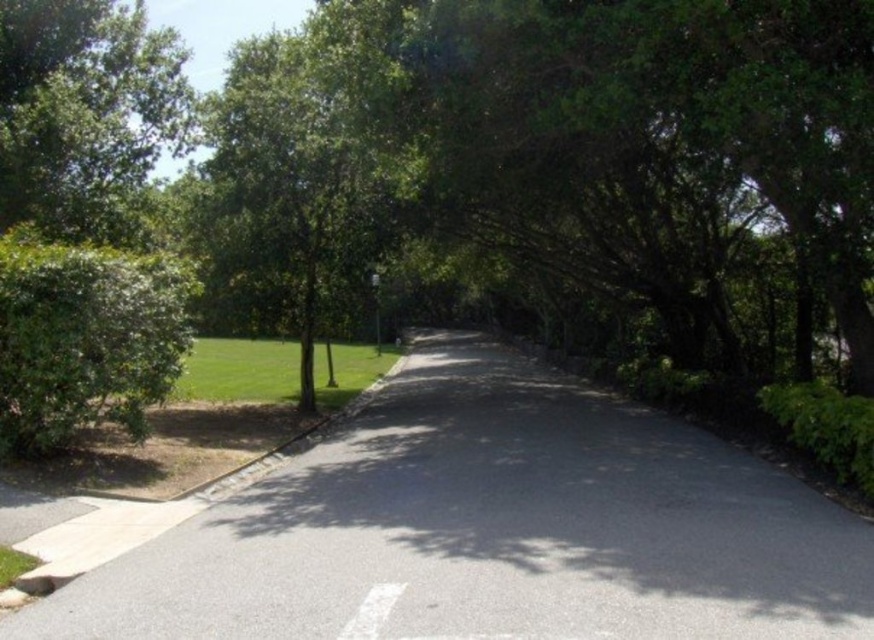
How far apart are white asphalt line at center and metallic silver street sign at center?

Answer: white asphalt line at center and metallic silver street sign at center are 67.42 feet apart from each other.

Is point (348, 628) closer to camera compared to point (373, 312)?

Yes.

Image resolution: width=874 pixels, height=640 pixels. Identify the location of white asphalt line at center. tap(372, 611).

Is point (130, 566) behind point (372, 288)?

No, (130, 566) is in front of (372, 288).

The height and width of the screenshot is (640, 874). What do you see at coordinates (491, 529) in the screenshot?
I see `smooth asphalt road at center` at bounding box center [491, 529].

Locate an element on the screen. This screenshot has width=874, height=640. smooth asphalt road at center is located at coordinates (491, 529).

Can you confirm if smooth asphalt road at center is taller than white asphalt line at center?

Yes.

Which of these two, smooth asphalt road at center or white asphalt line at center, stands taller?

smooth asphalt road at center

This screenshot has height=640, width=874. Identify the location of smooth asphalt road at center. (491, 529).